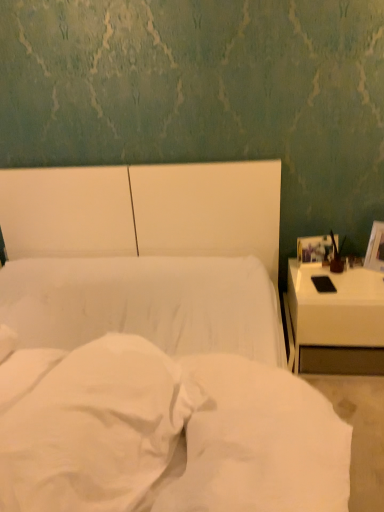
The width and height of the screenshot is (384, 512). Identify the location of vacant space that is to the left of matte brown vase at right. tap(301, 278).